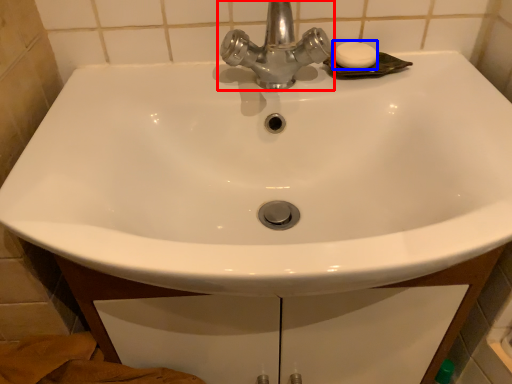
Question: Which point is further to the camera, tap (highlighted by a red box) or soap (highlighted by a blue box)?

Choices:
 (A) tap
 (B) soap

Answer: (B)